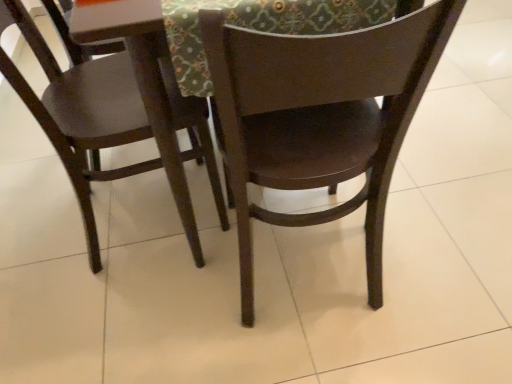
This screenshot has width=512, height=384. I want to click on free space in front of matte wood chair at left, which is counted as the first chair, starting from the left, so point(139,312).